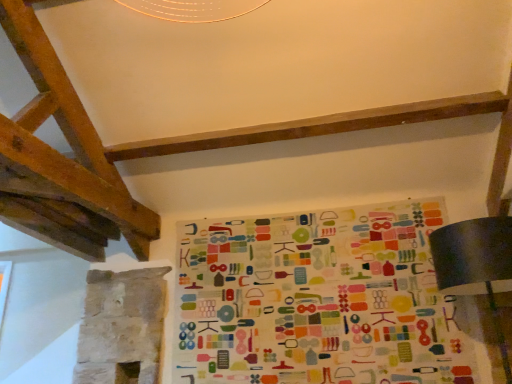
This screenshot has width=512, height=384. Identify the location of matte black lampshade at lower right. (476, 262).

What do you see at coordinates (476, 262) in the screenshot? The image size is (512, 384). I see `matte black lampshade at lower right` at bounding box center [476, 262].

The width and height of the screenshot is (512, 384). What do you see at coordinates (317, 300) in the screenshot? I see `multicolored fabric at center` at bounding box center [317, 300].

Where is `multicolored fabric at center`? multicolored fabric at center is located at coordinates (317, 300).

Find the location of a particular element. The height and width of the screenshot is (384, 512). matte black lampshade at lower right is located at coordinates point(476,262).

Which is more to the left, multicolored fabric at center or matte black lampshade at lower right?

From the viewer's perspective, multicolored fabric at center appears more on the left side.

Does multicolored fabric at center come in front of matte black lampshade at lower right?

No.

Considering the points (201, 270) and (496, 253), which point is in front, point (201, 270) or point (496, 253)?

The point (496, 253) is closer.

From the image's perspective, is multicolored fabric at center above or below matte black lampshade at lower right?

multicolored fabric at center is below matte black lampshade at lower right.

From a real-world perspective, is multicolored fabric at center positioned under matte black lampshade at lower right based on gravity?

No, from a real-world perspective, multicolored fabric at center is not below matte black lampshade at lower right.

Can you confirm if multicolored fabric at center is wider than matte black lampshade at lower right?

No, multicolored fabric at center is not wider than matte black lampshade at lower right.

Consider the image. Can you confirm if multicolored fabric at center is shorter than matte black lampshade at lower right?

Incorrect, the height of multicolored fabric at center does not fall short of that of matte black lampshade at lower right.

Considering the relative sizes of multicolored fabric at center and matte black lampshade at lower right in the image provided, is multicolored fabric at center bigger than matte black lampshade at lower right?

No, multicolored fabric at center is not bigger than matte black lampshade at lower right.

Is multicolored fabric at center completely or partially outside of matte black lampshade at lower right?

multicolored fabric at center lies outside matte black lampshade at lower right's area.

Is multicolored fabric at center next to matte black lampshade at lower right and touching it?

No, multicolored fabric at center is not in contact with matte black lampshade at lower right.

Could you tell me if multicolored fabric at center is facing matte black lampshade at lower right?

Yes, multicolored fabric at center faces towards matte black lampshade at lower right.

How much distance is there between multicolored fabric at center and matte black lampshade at lower right?

multicolored fabric at center is 32.55 inches away from matte black lampshade at lower right.

Find the location of a particular element. bulletin board on the left of matte black lampshade at lower right is located at coordinates click(317, 300).

Between matte black lampshade at lower right and multicolored fabric at center, which one appears on the right side from the viewer's perspective?

From the viewer's perspective, matte black lampshade at lower right appears more on the right side.

Which is in front, matte black lampshade at lower right or multicolored fabric at center?

matte black lampshade at lower right is closer to the camera.

Consider the image. Which is closer, (474, 232) or (375, 335)?

The point (474, 232) is closer.

From the image's perspective, is matte black lampshade at lower right over multicolored fabric at center?

Yes, from the image's perspective, matte black lampshade at lower right is above multicolored fabric at center.

From a real-world perspective, is matte black lampshade at lower right physically above multicolored fabric at center?

No, from a real-world perspective, matte black lampshade at lower right is not on top of multicolored fabric at center.

Which object is wider, matte black lampshade at lower right or multicolored fabric at center?

With larger width is matte black lampshade at lower right.

In terms of height, does matte black lampshade at lower right look taller or shorter compared to multicolored fabric at center?

In the image, matte black lampshade at lower right appears to be shorter than multicolored fabric at center.

Does matte black lampshade at lower right have a larger size compared to multicolored fabric at center?

Yes.

Is matte black lampshade at lower right not within multicolored fabric at center?

matte black lampshade at lower right lies outside multicolored fabric at center's area.

Is matte black lampshade at lower right placed right next to multicolored fabric at center?

No, matte black lampshade at lower right is not next to multicolored fabric at center.

Looking at this image, is matte black lampshade at lower right looking in the opposite direction of multicolored fabric at center?

matte black lampshade at lower right does not have its back to multicolored fabric at center.

How many degrees apart are the facing directions of matte black lampshade at lower right and multicolored fabric at center?

They differ by 0.803 degrees in their facing directions.

Find the location of a particular element. This screenshot has height=384, width=512. table lamp that appears below the multicolored fabric at center (from a real-world perspective) is located at coordinates (476, 262).

Identify the location of bulletin board that appears above the matte black lampshade at lower right (from a real-world perspective). The width and height of the screenshot is (512, 384). (317, 300).

The image size is (512, 384). In order to click on bulletin board that appears behind the matte black lampshade at lower right in this screenshot , I will do `click(317, 300)`.